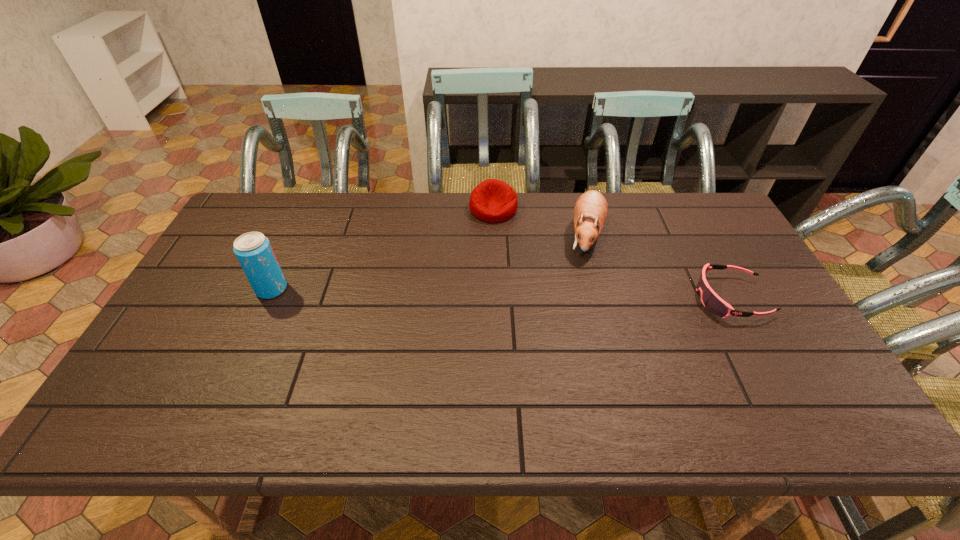
The image size is (960, 540). In order to click on the leftmost object in this screenshot , I will do `click(253, 250)`.

Locate an element on the screen. soda can is located at coordinates (253, 250).

At what (x,y) coordinates should I click in order to perform the action: click on the shortest object. Please return your answer as a coordinate pair (x, y). This screenshot has width=960, height=540. Looking at the image, I should click on (711, 301).

Locate an element on the screen. The height and width of the screenshot is (540, 960). goggles is located at coordinates (711, 301).

Identify the location of the second tallest object. The width and height of the screenshot is (960, 540). (590, 212).

Identify the location of the second object from right to left. The height and width of the screenshot is (540, 960). (590, 212).

Where is `the third tallest object`? The image size is (960, 540). the third tallest object is located at coordinates (493, 201).

The height and width of the screenshot is (540, 960). Identify the location of beanbag. (493, 201).

Where is `vacant space located 0.350m on the back of the tallest object`? Image resolution: width=960 pixels, height=540 pixels. vacant space located 0.350m on the back of the tallest object is located at coordinates (309, 207).

Identify the location of blank area located 0.350m on the front-facing side of the shortest object. This screenshot has width=960, height=540. (570, 298).